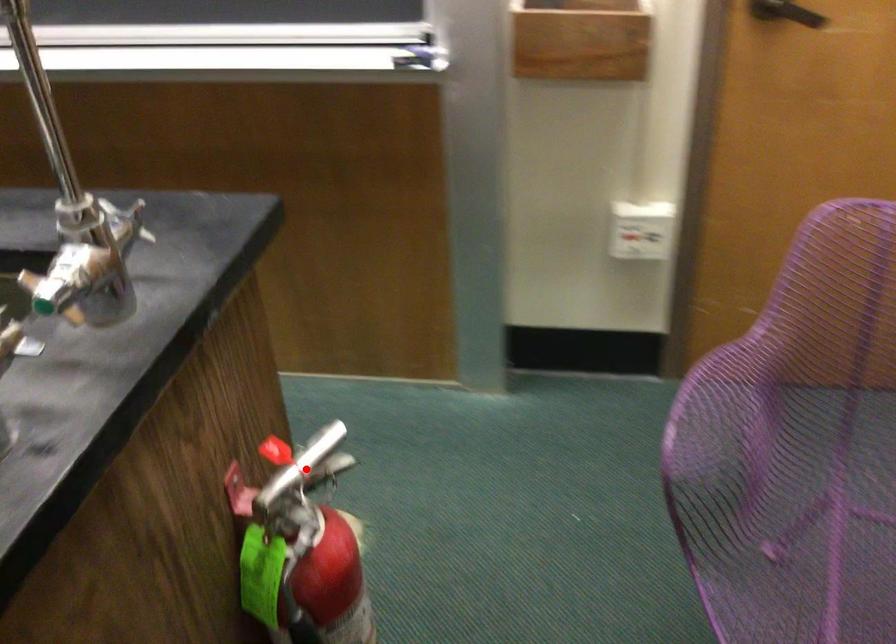
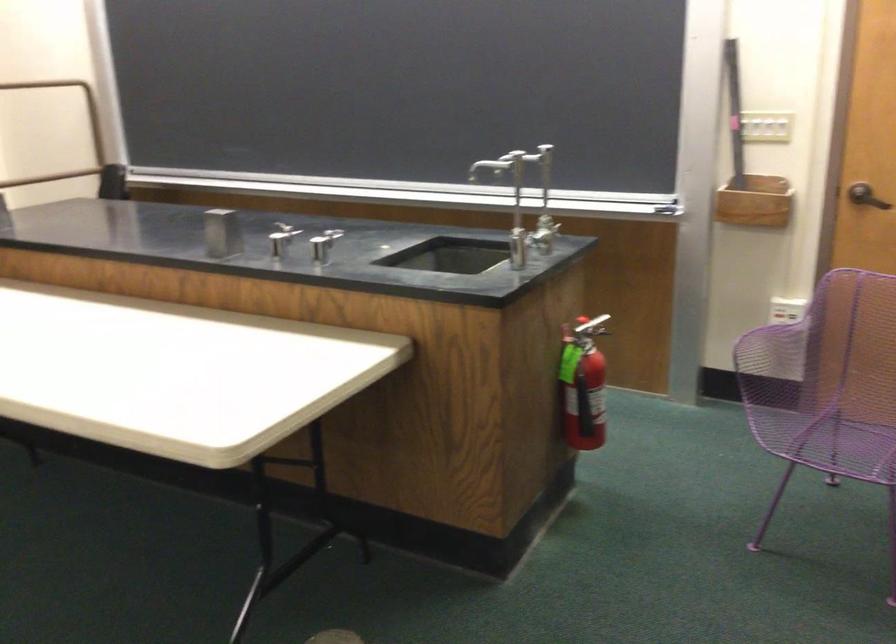
Question: I am providing you with two images of the same scene from different viewpoints. Image1 has a red point marked. In image2, the corresponding 3D location appears at what relative position? Reply with the corresponding letter.

Choices:
 (A) Closer
 (B) Farther

Answer: (B)